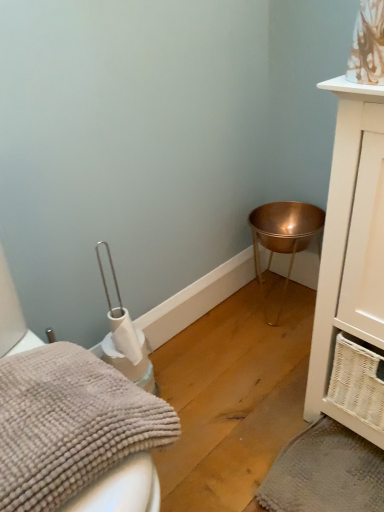
What is the approximate height of gray fluffy bath towel at lower left, positioned as the first bath towel in front-to-back order?

gray fluffy bath towel at lower left, positioned as the first bath towel in front-to-back order, is 4.96 inches tall.

At what (x,y) coordinates should I click in order to perform the action: click on copper metallic bowl at lower right. Please return your answer as a coordinate pair (x, y). This screenshot has height=512, width=384. Looking at the image, I should click on click(x=284, y=238).

Is copper metallic bowl at lower right next to gray textured bath towel at lower right, placed as the 2th bath towel when sorted from left to right, and touching it?

They are not placed beside each other.

The height and width of the screenshot is (512, 384). Identify the location of changing table on the right side of gray textured bath towel at lower right, placed as the 2th bath towel when sorted from left to right. (284, 238).

Which of these two, copper metallic bowl at lower right or gray textured bath towel at lower right, placed as the 2th bath towel when sorted from left to right, is thinner?

copper metallic bowl at lower right is thinner.

Is point (261, 215) closer to camera compared to point (363, 480)?

No, (261, 215) is behind (363, 480).

From a real-world perspective, is gray fluffy bath towel at lower left, which is the second bath towel in back-to-front order, beneath white wicker cabinet at right?

Yes.

The height and width of the screenshot is (512, 384). What are the coordinates of `bathroom cabinet located behind the gray fluffy bath towel at lower left, the 1th bath towel viewed from the top` in the screenshot? It's located at (352, 270).

Which is closer to the camera, [103,437] or [367,290]?

The point [103,437] is closer to the camera.

Is gray fluffy bath towel at lower left, the 2th bath towel from the right, far from white wicker cabinet at right?

They are positioned close to each other.

Based on the photo, from a real-world perspective, is white wicker cabinet at right on gray textured bath towel at lower right, acting as the second bath towel starting from the front?

Correct, in the physical world, white wicker cabinet at right is higher than gray textured bath towel at lower right, acting as the second bath towel starting from the front.

Which object is closer to the camera taking this photo, white wicker cabinet at right or gray textured bath towel at lower right, marked as the 1th bath towel in a right-to-left arrangement?

white wicker cabinet at right.

Choose the correct answer: Is white wicker cabinet at right inside gray textured bath towel at lower right, marked as the 1th bath towel in a right-to-left arrangement, or outside it?

white wicker cabinet at right is located beyond the bounds of gray textured bath towel at lower right, marked as the 1th bath towel in a right-to-left arrangement.

Which is closer to the camera, [341,229] or [360,507]?

Clearly, point [341,229] is closer to the camera than point [360,507].

Could you measure the distance between white wicker cabinet at right and gray fluffy bath towel at lower left, the 2th bath towel from the right?

20.61 inches.

Considering the relative sizes of white wicker cabinet at right and gray fluffy bath towel at lower left, the 2th bath towel from the right, in the image provided, is white wicker cabinet at right smaller than gray fluffy bath towel at lower left, the 2th bath towel from the right,?

No.

Which of these two, white wicker cabinet at right or gray fluffy bath towel at lower left, the 1th bath towel viewed from the top, is thinner?

gray fluffy bath towel at lower left, the 1th bath towel viewed from the top, is thinner.

Which is behind, white wicker cabinet at right or gray fluffy bath towel at lower left, the 1th bath towel viewed from the top?

white wicker cabinet at right.

Where is `bath towel that is in front of the gray textured bath towel at lower right, which is the second bath towel in top-to-bottom order`? bath towel that is in front of the gray textured bath towel at lower right, which is the second bath towel in top-to-bottom order is located at coordinates (70, 424).

Which is more to the left, gray fluffy bath towel at lower left, positioned as the first bath towel in front-to-back order, or gray textured bath towel at lower right, acting as the second bath towel starting from the front?

gray fluffy bath towel at lower left, positioned as the first bath towel in front-to-back order.

Considering their positions, is gray fluffy bath towel at lower left, which is the second bath towel in back-to-front order, located in front of or behind gray textured bath towel at lower right, marked as the 1th bath towel in a right-to-left arrangement?

In the image, gray fluffy bath towel at lower left, which is the second bath towel in back-to-front order, appears in front of gray textured bath towel at lower right, marked as the 1th bath towel in a right-to-left arrangement.

Who is smaller, gray textured bath towel at lower right, marked as the 1th bath towel in a right-to-left arrangement, or copper metallic bowl at lower right?

gray textured bath towel at lower right, marked as the 1th bath towel in a right-to-left arrangement, is smaller.

Can you confirm if gray textured bath towel at lower right, which is the 1th bath towel in bottom-to-top order, is positioned to the right of copper metallic bowl at lower right?

Incorrect, gray textured bath towel at lower right, which is the 1th bath towel in bottom-to-top order, is not on the right side of copper metallic bowl at lower right.

In the image, is gray textured bath towel at lower right, marked as the 1th bath towel in a right-to-left arrangement, positioned in front of or behind copper metallic bowl at lower right?

gray textured bath towel at lower right, marked as the 1th bath towel in a right-to-left arrangement, is in front of copper metallic bowl at lower right.

From a real-world perspective, which object stands above the other?

From a 3D spatial view, white wicker cabinet at right is above.

Can you see white wicker cabinet at right touching copper metallic bowl at lower right?

No, white wicker cabinet at right is not next to copper metallic bowl at lower right.

Is point (381, 116) positioned after point (278, 320)?

No, it is in front of (278, 320).

Can you tell me how much white wicker cabinet at right and copper metallic bowl at lower right differ in facing direction?

0.000263 degrees separate the facing orientations of white wicker cabinet at right and copper metallic bowl at lower right.

Locate an element on the screen. changing table above the gray textured bath towel at lower right, placed as the 2th bath towel when sorted from left to right (from the image's perspective) is located at coordinates (284, 238).

From the image's perspective, count 1st bath towels downward from the white wicker cabinet at right and point to it. Please provide its 2D coordinates.

[(70, 424)]

Looking at the image, which one is located closer to white wicker cabinet at right, copper metallic bowl at lower right or gray textured bath towel at lower right, marked as the 1th bath towel in a right-to-left arrangement?

gray textured bath towel at lower right, marked as the 1th bath towel in a right-to-left arrangement.

In the scene shown: From the image, which object appears to be nearer to gray textured bath towel at lower right, marked as the 1th bath towel in a right-to-left arrangement, gray fluffy bath towel at lower left, positioned as the first bath towel in front-to-back order, or copper metallic bowl at lower right?

gray fluffy bath towel at lower left, positioned as the first bath towel in front-to-back order.

From the image, which object appears to be nearer to copper metallic bowl at lower right, gray textured bath towel at lower right, acting as the second bath towel starting from the front, or gray fluffy bath towel at lower left, the 2th bath towel from the right?

The object closer to copper metallic bowl at lower right is gray textured bath towel at lower right, acting as the second bath towel starting from the front.

Looking at the image, which one is located closer to gray textured bath towel at lower right, marked as the 1th bath towel in a right-to-left arrangement, gray fluffy bath towel at lower left, the 1th bath towel from the left, or white wicker cabinet at right?

white wicker cabinet at right is closer to gray textured bath towel at lower right, marked as the 1th bath towel in a right-to-left arrangement.

Considering their positions, is copper metallic bowl at lower right positioned closer to gray fluffy bath towel at lower left, which is the 2th bath towel in bottom-to-top order, than gray textured bath towel at lower right, placed as the 2th bath towel when sorted from left to right?

gray textured bath towel at lower right, placed as the 2th bath towel when sorted from left to right.

Based on their spatial positions, is white wicker cabinet at right or gray textured bath towel at lower right, acting as the second bath towel starting from the front, closer to copper metallic bowl at lower right?

The object closer to copper metallic bowl at lower right is white wicker cabinet at right.

From the image, which object appears to be farther from white wicker cabinet at right, gray fluffy bath towel at lower left, the 1th bath towel viewed from the top, or copper metallic bowl at lower right?

copper metallic bowl at lower right.

Looking at the image, which one is located closer to copper metallic bowl at lower right, gray textured bath towel at lower right, which is the second bath towel in top-to-bottom order, or white wicker cabinet at right?

Among the two, white wicker cabinet at right is located nearer to copper metallic bowl at lower right.

Image resolution: width=384 pixels, height=512 pixels. I want to click on bath towel located between gray fluffy bath towel at lower left, which is the 2th bath towel in bottom-to-top order, and white wicker cabinet at right in the left-right direction, so click(x=325, y=473).

Where is `bath towel between gray fluffy bath towel at lower left, the 1th bath towel from the left, and copper metallic bowl at lower right from front to back`? This screenshot has height=512, width=384. bath towel between gray fluffy bath towel at lower left, the 1th bath towel from the left, and copper metallic bowl at lower right from front to back is located at coordinates (325, 473).

This screenshot has height=512, width=384. I want to click on bathroom cabinet positioned between gray fluffy bath towel at lower left, which is the 2th bath towel in bottom-to-top order, and copper metallic bowl at lower right from near to far, so click(x=352, y=270).

Identify the location of bath towel located between white wicker cabinet at right and copper metallic bowl at lower right in the depth direction. The width and height of the screenshot is (384, 512). (325, 473).